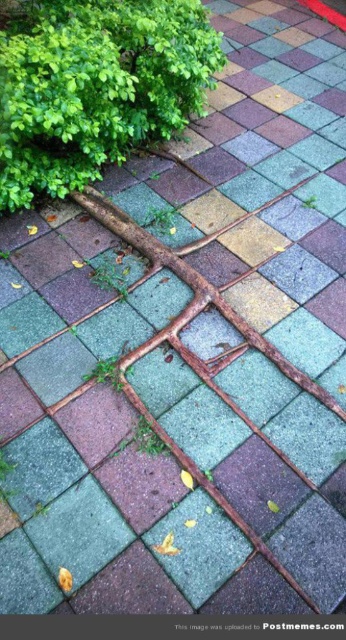
In the scene shown: You are standing on the paved area with the green leafy bush at upper left and the rusty metal tree root at center. Which object is higher up in the image?

The green leafy bush at upper left is above the rusty metal tree root at center, so it is higher up in the image.

You are standing in the tiled area and want to move towards the rusty metal tree root at center. Which direction should you walk to avoid the green leafy bush at upper left?

The green leafy bush at upper left is positioned on the left side of the rusty metal tree root at center. To avoid it, walk towards the rusty metal tree root at center from the right side.